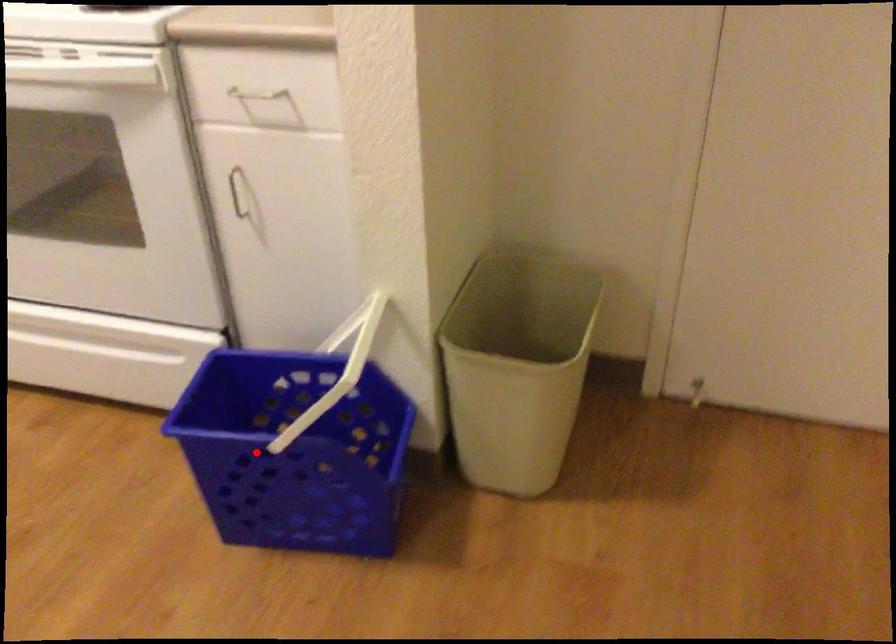
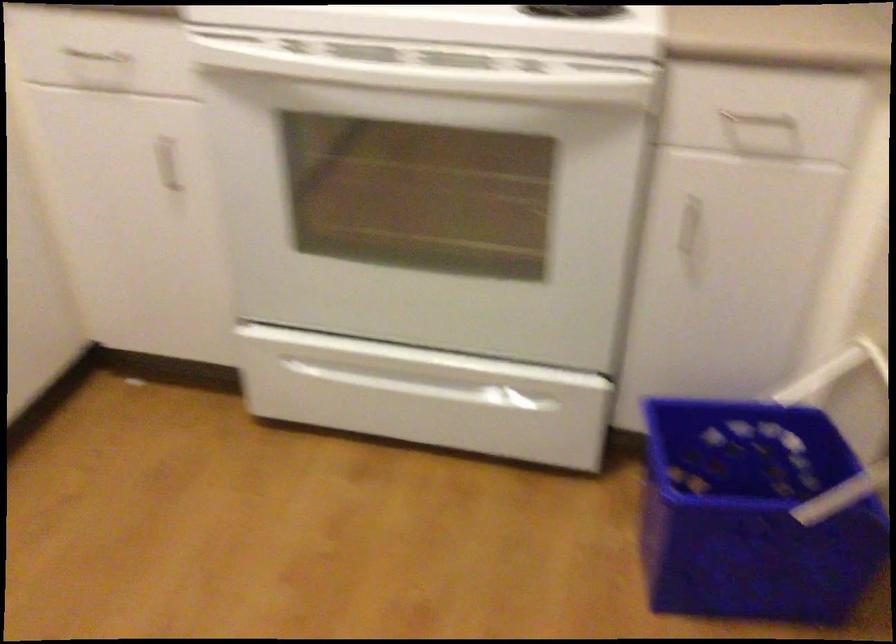
Question: I am providing you with two images of the same scene from different viewpoints. Image1 has a red point marked. In image2, the corresponding 3D location appears at what relative position? Reply with the corresponding letter.

Choices:
 (A) Closer
 (B) Farther

Answer: (A)